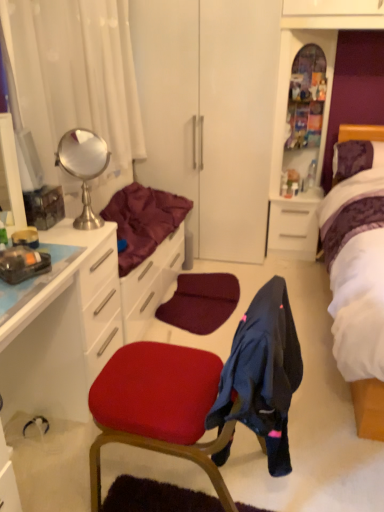
Question: Is maroon fabric at left surrounding white glossy file cabinet at center right, the 1th file cabinet from the bottom?

Choices:
 (A) yes
 (B) no

Answer: (B)

Question: Considering the relative sizes of maroon fabric at left and white glossy file cabinet at center right, the 1th file cabinet from the bottom, in the image provided, is maroon fabric at left wider than white glossy file cabinet at center right, the 1th file cabinet from the bottom,?

Choices:
 (A) no
 (B) yes

Answer: (B)

Question: Is maroon fabric at left turned away from white glossy file cabinet at center right, the 1th file cabinet from the bottom?

Choices:
 (A) yes
 (B) no

Answer: (B)

Question: Is maroon fabric at left touching white glossy file cabinet at center right, the 1th file cabinet from the bottom?

Choices:
 (A) yes
 (B) no

Answer: (B)

Question: From the image's perspective, is maroon fabric at left located beneath white glossy file cabinet at center right, the 1th file cabinet from the bottom?

Choices:
 (A) no
 (B) yes

Answer: (B)

Question: Considering their positions, is matte red chair at center located in front of or behind maroon fabric at left?

Choices:
 (A) behind
 (B) front

Answer: (B)

Question: From a real-world perspective, is matte red chair at center above or below maroon fabric at left?

Choices:
 (A) below
 (B) above

Answer: (A)

Question: Would you say matte red chair at center is inside or outside maroon fabric at left?

Choices:
 (A) inside
 (B) outside

Answer: (B)

Question: Considering the positions of matte red chair at center and maroon fabric at left in the image, is matte red chair at center bigger or smaller than maroon fabric at left?

Choices:
 (A) big
 (B) small

Answer: (A)

Question: From the image's perspective, is dark blue fabric at center located above or below white fabric curtain at left?

Choices:
 (A) above
 (B) below

Answer: (B)

Question: Is point (249, 380) positioned closer to the camera than point (38, 76)?

Choices:
 (A) closer
 (B) farther

Answer: (A)

Question: Is dark blue fabric at center to the left or to the right of white fabric curtain at left in the image?

Choices:
 (A) left
 (B) right

Answer: (B)

Question: Looking at their shapes, would you say dark blue fabric at center is wider or thinner than white fabric curtain at left?

Choices:
 (A) thin
 (B) wide

Answer: (B)

Question: Is dark blue fabric at center taller or shorter than matte red chair at center?

Choices:
 (A) short
 (B) tall

Answer: (A)

Question: Looking at the image, does dark blue fabric at center seem bigger or smaller compared to matte red chair at center?

Choices:
 (A) big
 (B) small

Answer: (B)